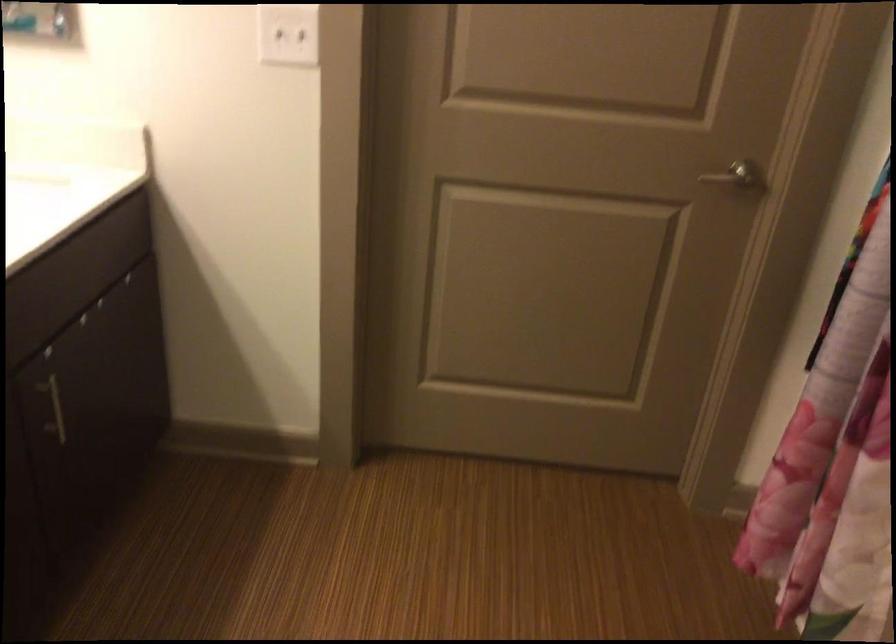
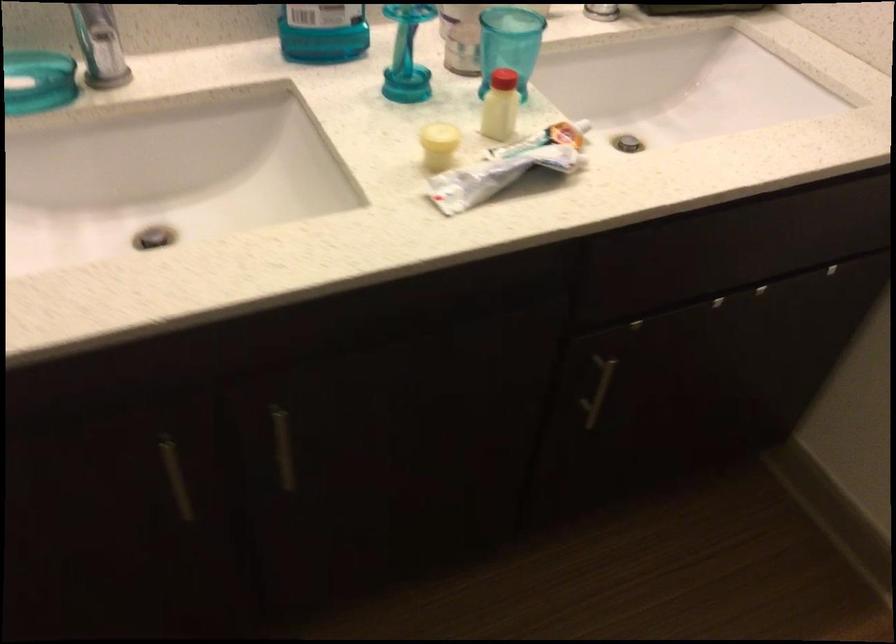
Based on the continuous images, in which direction is the camera rotating?

The rotation direction of the camera is left-down.